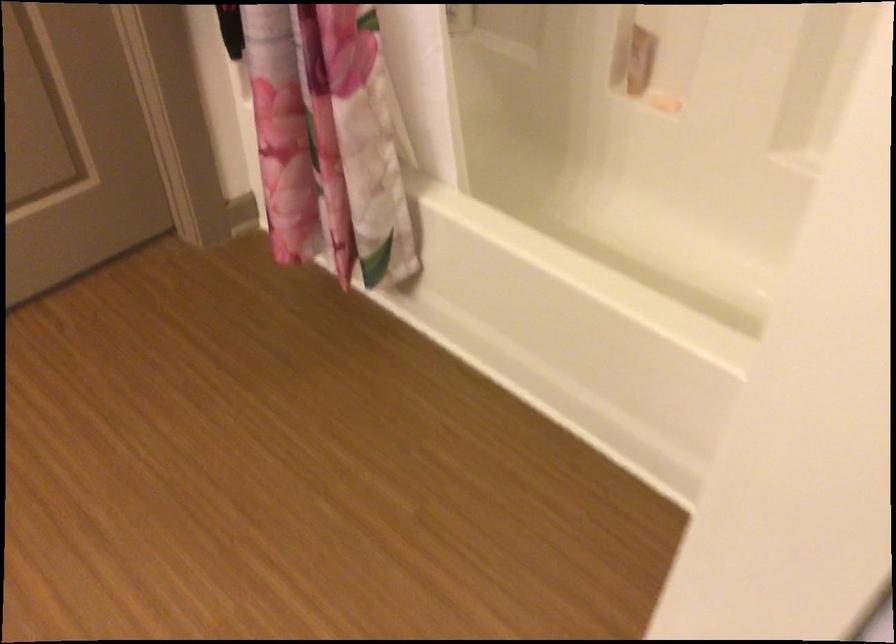
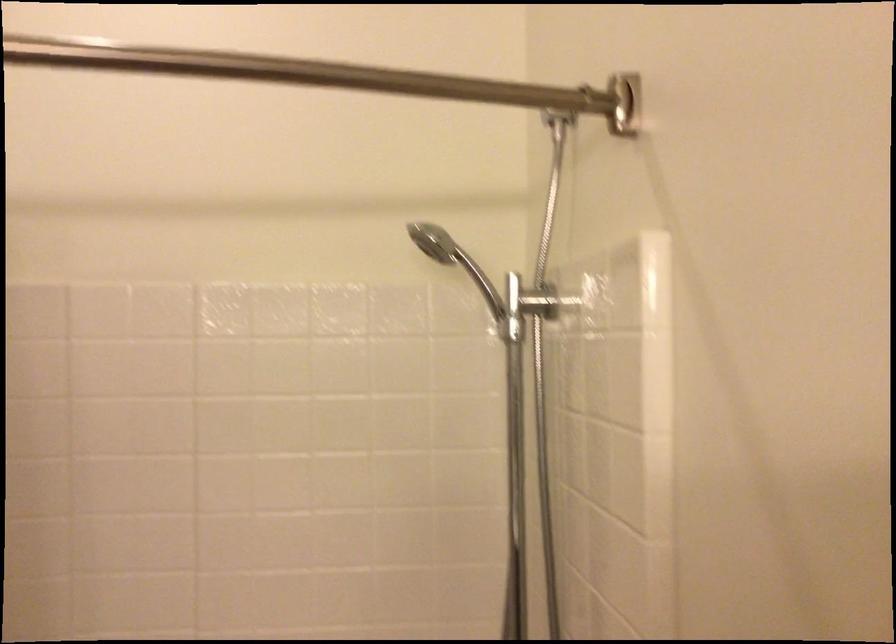
Based on the continuous images, in which direction is the camera rotating?

The camera's rotation is toward right-up.